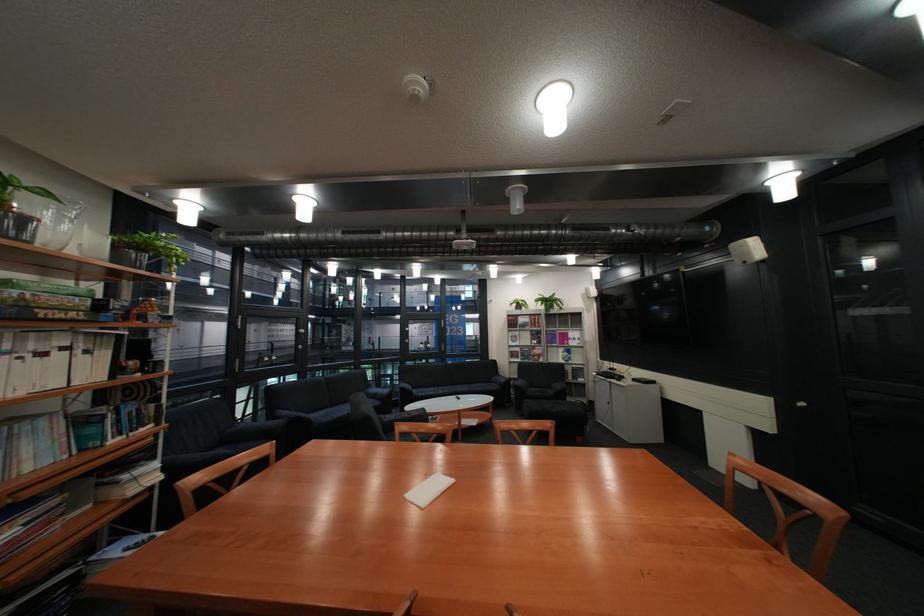
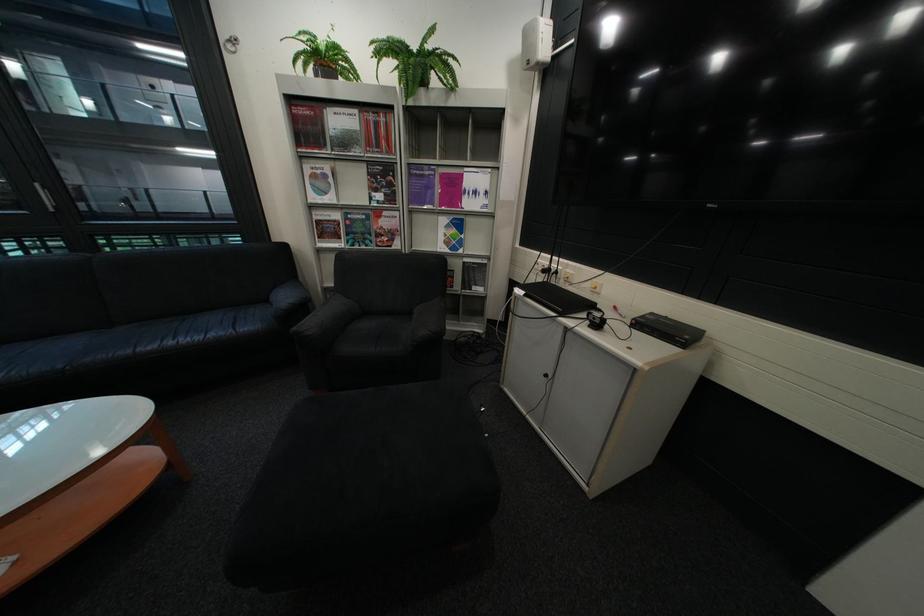
Locate, in the second image, the point that corresponds to (588,342) in the first image.

(484, 204)